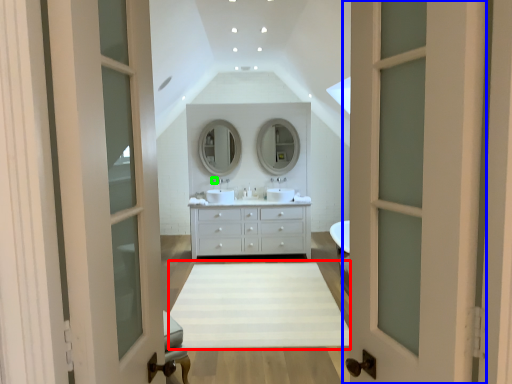
Question: Which object is positioned farthest from plain (highlighted by a red box)? Select from door (highlighted by a blue box) and faucet (highlighted by a green box).

Choices:
 (A) door
 (B) faucet

Answer: (A)